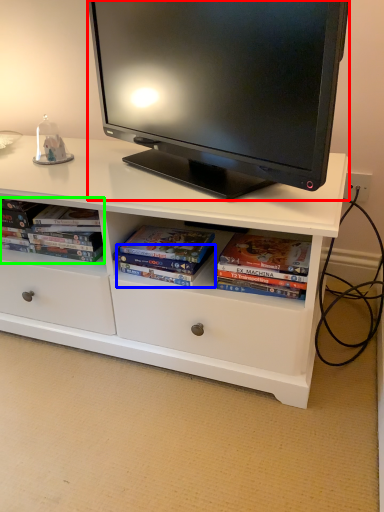
Question: Estimate the real-world distances between objects in this image. Which object is closer to television (highlighted by a red box), paperback book (highlighted by a blue box) or book (highlighted by a green box)?

Choices:
 (A) paperback book
 (B) book

Answer: (B)